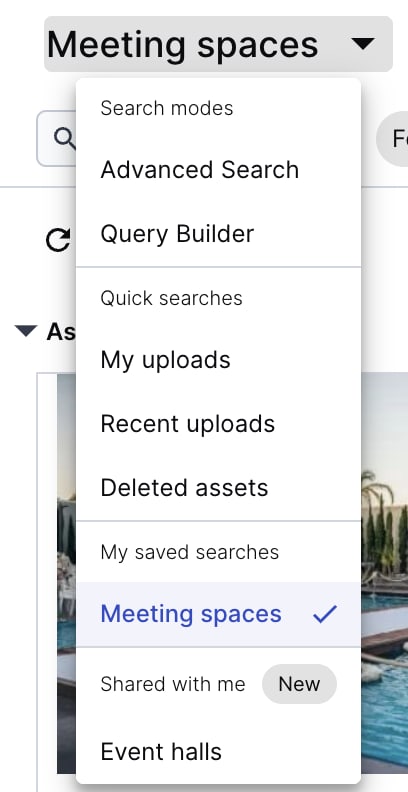
The height and width of the screenshot is (792, 408). Find the location of `meeting spaces`. meeting spaces is located at coordinates (111, 54), (131, 619).